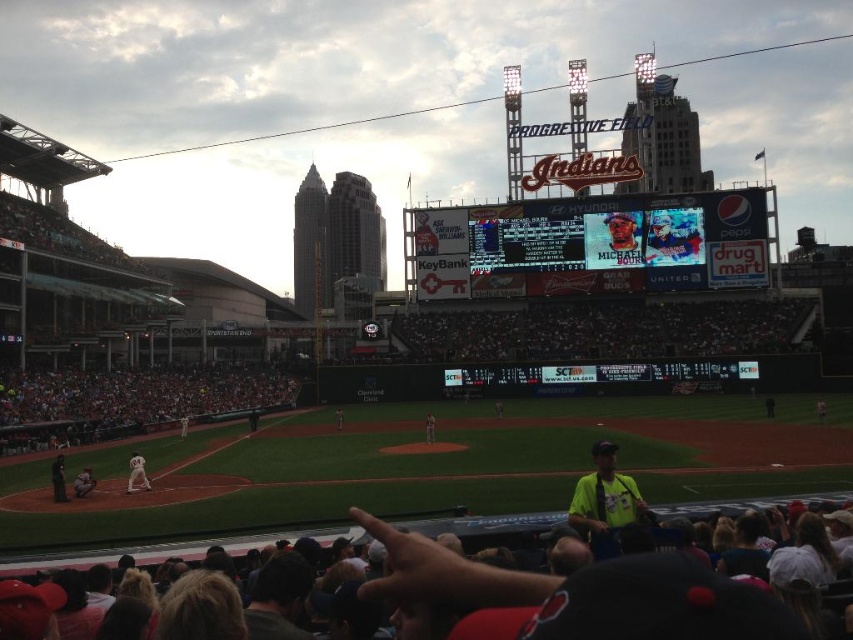
Who is positioned more to the left, matte digital display at center or white uniformed player at center?

white uniformed player at center is more to the left.

Who is more forward, (503, 276) or (337, 413)?

Point (337, 413) is more forward.

Locate an element on the screen. matte digital display at center is located at coordinates (592, 244).

Can you confirm if green jersey at lower left is thinner than matte gray uniform at lower left?

In fact, green jersey at lower left might be wider than matte gray uniform at lower left.

Which is above, green jersey at lower left or matte gray uniform at lower left?

green jersey at lower left is higher up.

Measure the distance between green jersey at lower left and camera.

green jersey at lower left is 95.76 meters from camera.

The width and height of the screenshot is (853, 640). Find the location of `green jersey at lower left`. green jersey at lower left is located at coordinates (57, 477).

Who is shorter, yellow-green shirt at lower right or green jersey at lower left?

With less height is green jersey at lower left.

Is yellow-green shirt at lower right closer to camera compared to green jersey at lower left?

Yes, yellow-green shirt at lower right is in front of green jersey at lower left.

Identify the location of yellow-green shirt at lower right. (604, 493).